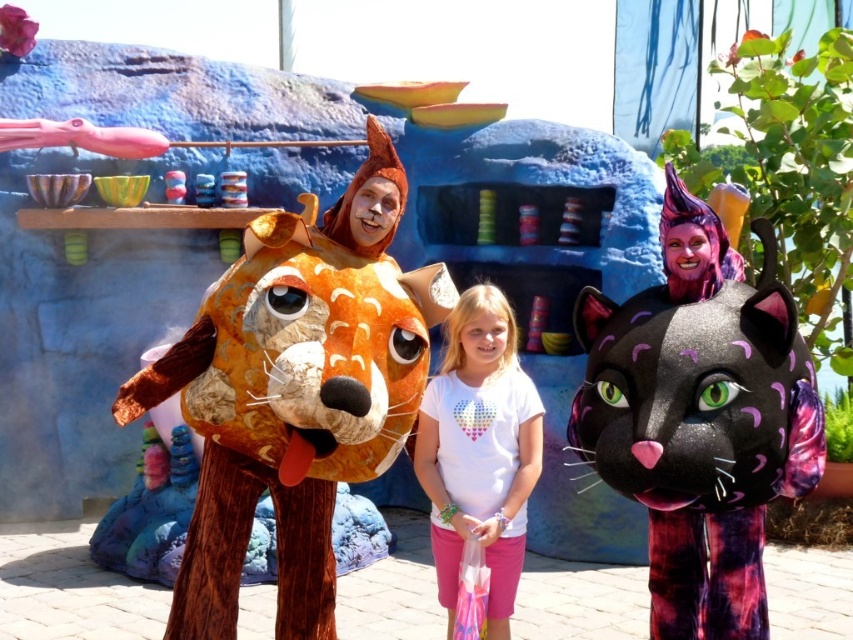
Question: Does black furry cat at right have a greater width compared to white cotton t-shirt at center?

Choices:
 (A) no
 (B) yes

Answer: (B)

Question: Which point appears farthest from the camera in this image?

Choices:
 (A) (532, 381)
 (B) (196, 429)
 (C) (602, 317)

Answer: (A)

Question: Among these objects, which one is farthest from the camera?

Choices:
 (A) wooden textured fox head at center
 (B) black furry cat at right
 (C) white cotton t-shirt at center

Answer: (C)

Question: Where is black furry cat at right located in relation to white cotton t-shirt at center in the image?

Choices:
 (A) right
 (B) left

Answer: (A)

Question: Which of the following is the farthest from the observer?

Choices:
 (A) (753, 561)
 (B) (479, 532)
 (C) (252, 456)

Answer: (B)

Question: Can you confirm if black furry cat at right is positioned below white cotton t-shirt at center?

Choices:
 (A) no
 (B) yes

Answer: (A)